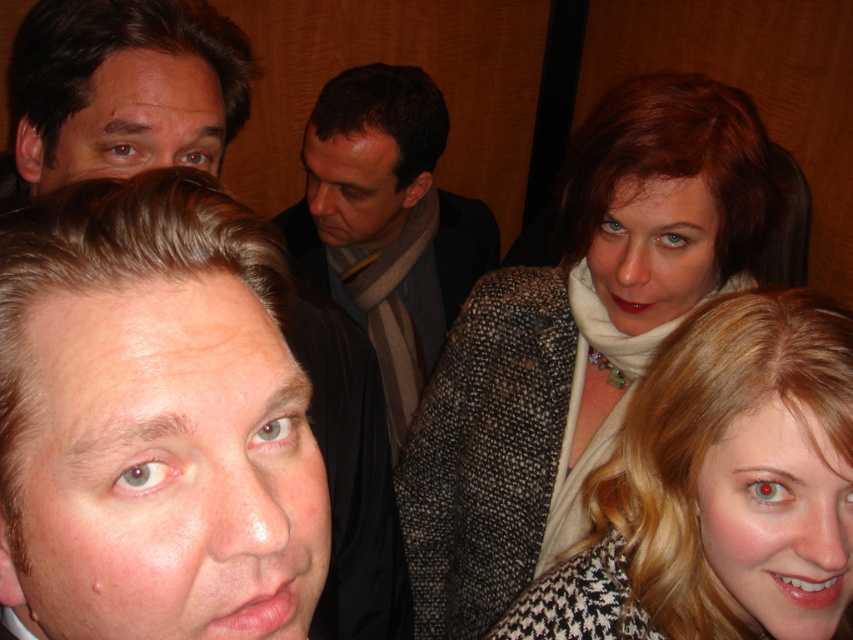
You are organizing a coat rack and need to place the speckled wool coat at upper right and the dark gray scarf at center. Which item requires more space on the rack?

The dark gray scarf at center requires more space on the rack because it is larger than the speckled wool coat at upper right.

You are a photographer adjusting the camera focus. The camera can only focus on objects within a 35 inch range. Are the blonde hair at upper right and dark gray scarf at center within the focus range?

The blonde hair at upper right is 38.35 inches from the dark gray scarf at center. Since the distance between them is greater than 35 inches, the camera cannot focus on both simultaneously.

Based on the scene description, where is the blonde hair at upper right located in the image?

The blonde hair at upper right is located at point coordinates of [711,484].